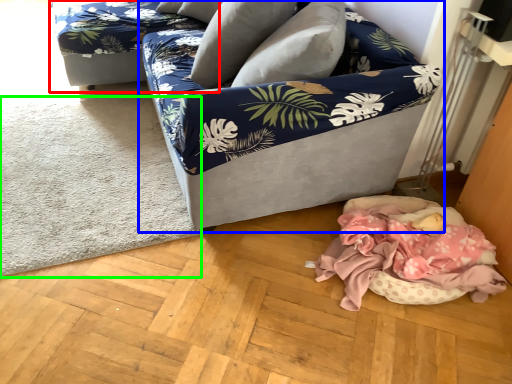
Question: Which object is the closest to the couch (highlighted by a red box)? Choose among these: studio couch (highlighted by a blue box) or mat (highlighted by a green box).

Choices:
 (A) studio couch
 (B) mat

Answer: (B)